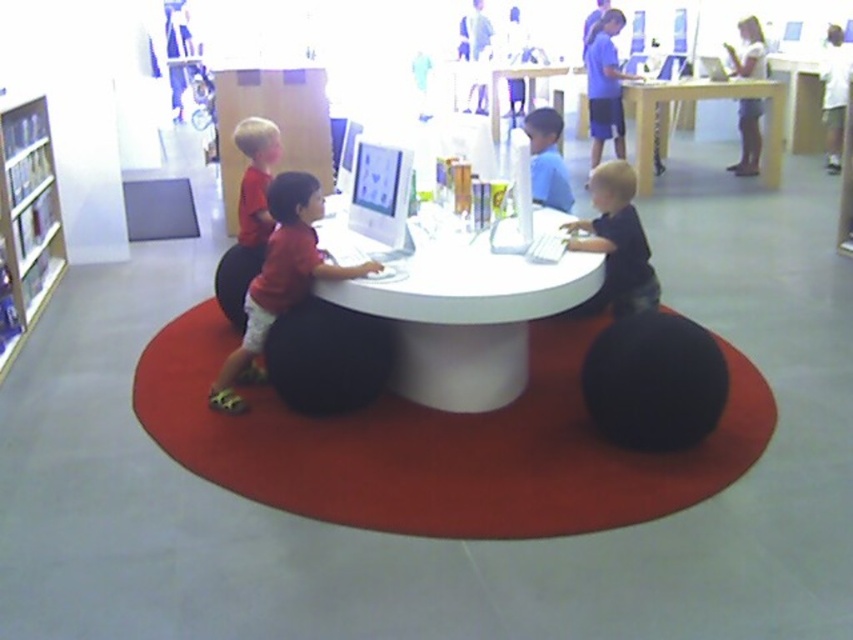
Question: Considering the real-world distances, which object is farthest from the matte red shirt at center?

Choices:
 (A) wooden bookshelf at left
 (B) black matte boy at center
 (C) blue shirt at center

Answer: (A)

Question: Is matte red shirt at center in front of black matte boy at center?

Choices:
 (A) yes
 (B) no

Answer: (A)

Question: From the image, what is the correct spatial relationship of black matte boy at center in relation to matte white monitor at center?

Choices:
 (A) above
 (B) below

Answer: (B)

Question: Which is farther from the matte red shirt at center?

Choices:
 (A) matte white monitor at center
 (B) wooden bookshelf at left
 (C) blue shirt at center

Answer: (B)

Question: Does matte red shirt at center appear over black matte boy at center?

Choices:
 (A) no
 (B) yes

Answer: (A)

Question: Which of these objects is positioned farthest from the matte red shirt at center?

Choices:
 (A) blue matte shirt at upper right
 (B) black matte boy at center
 (C) wooden bookshelf at left
 (D) blue shirt at center

Answer: (A)